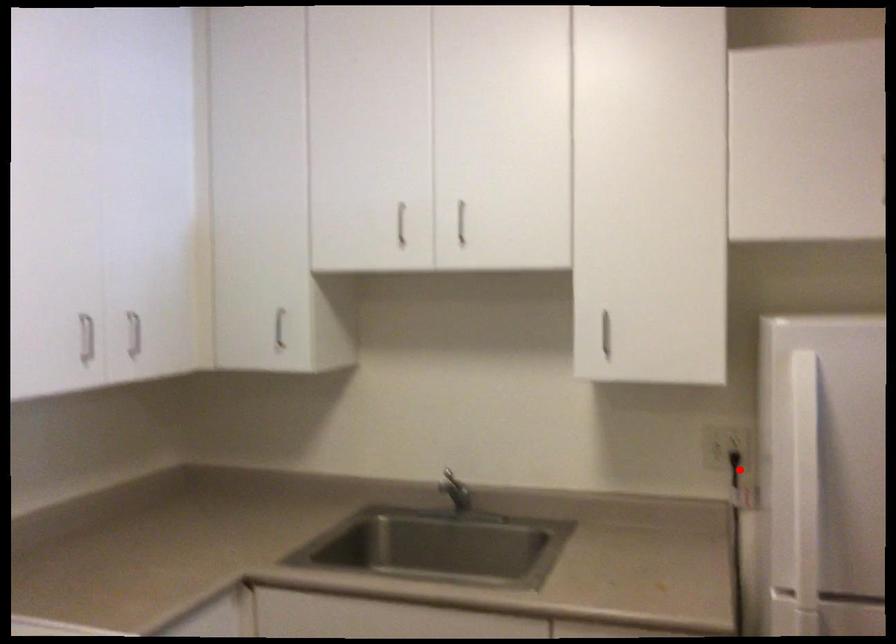
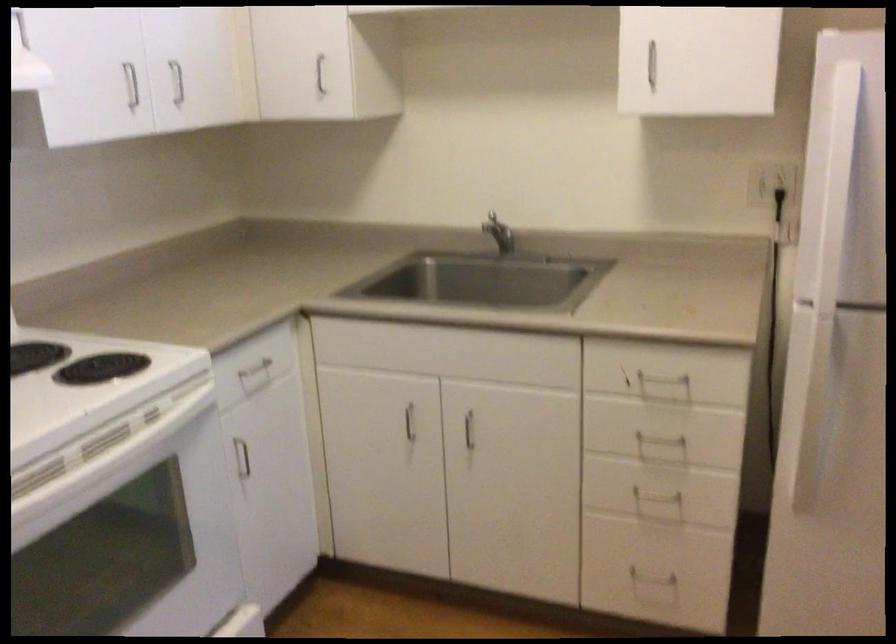
Locate, in the second image, the point that corresponds to the highlighted location in the first image.

(779, 202)